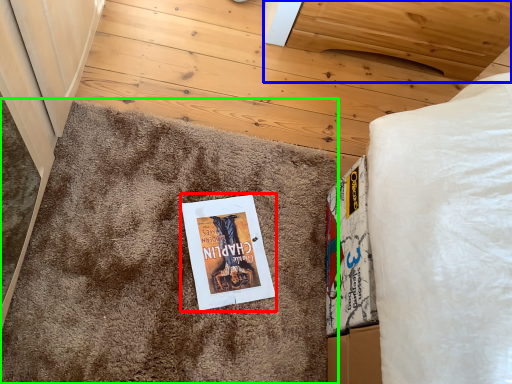
Question: Which object is positioned farthest from fiction book (highlighted by a red box)? Select from furniture (highlighted by a blue box) and doormat (highlighted by a green box).

Choices:
 (A) furniture
 (B) doormat

Answer: (A)